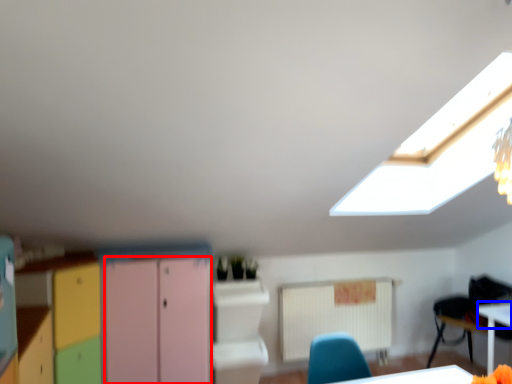
Question: Which object appears closest to the camera in this image, file cabinet (highlighted by a red box) or table top (highlighted by a blue box)?

Choices:
 (A) file cabinet
 (B) table top

Answer: (A)